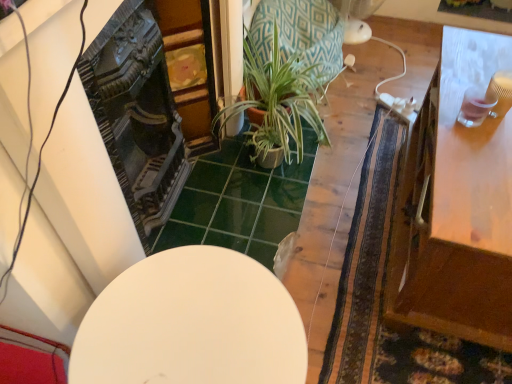
Question: Considering the positions of green textured pot at center and white matte table at center, the second table positioned from the right, in the image, is green textured pot at center wider or thinner than white matte table at center, the second table positioned from the right,?

Choices:
 (A) wide
 (B) thin

Answer: (A)

Question: Considering the positions of point (279, 127) and point (184, 258), is point (279, 127) closer or farther from the camera than point (184, 258)?

Choices:
 (A) farther
 (B) closer

Answer: (A)

Question: Which is farther from the green textured pot at center?

Choices:
 (A) white matte table at center, the second table positioned from the right
 (B) wooden table at right, the first table from the right

Answer: (A)

Question: Considering the real-world distances, which object is closest to the wooden table at right, the first table from the right?

Choices:
 (A) green textured pot at center
 (B) white matte table at center, the second table positioned from the right

Answer: (B)